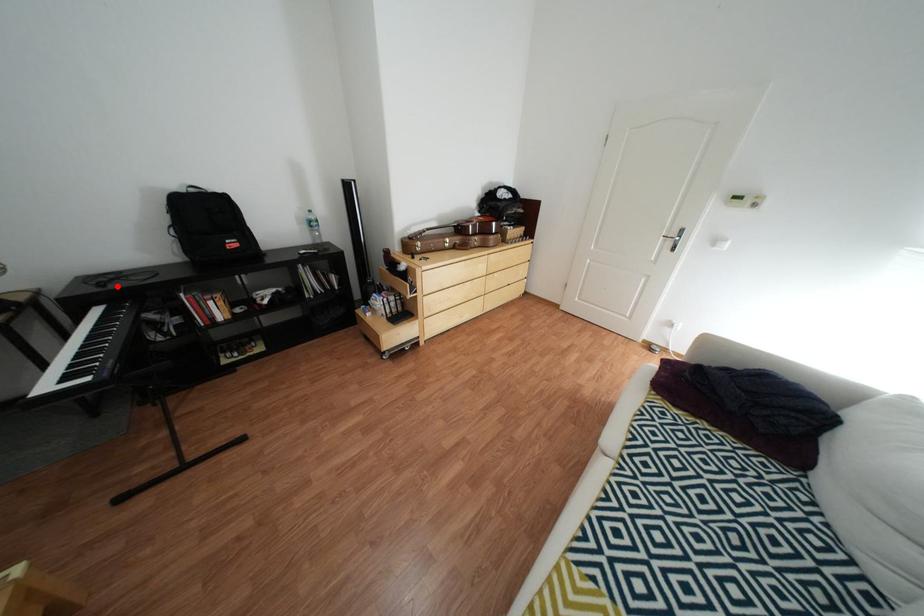
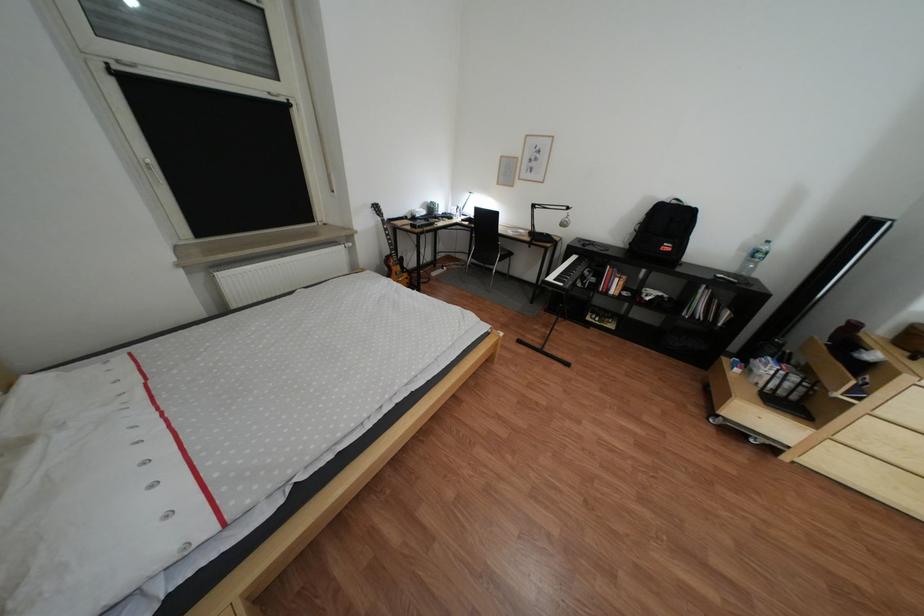
Question: I am providing you with two images of the same scene from different viewpoints. Given a red point in image1, look at the same physical point in image2. Is it:

Choices:
 (A) Closer to the viewpoint
 (B) Farther from the viewpoint

Answer: (A)